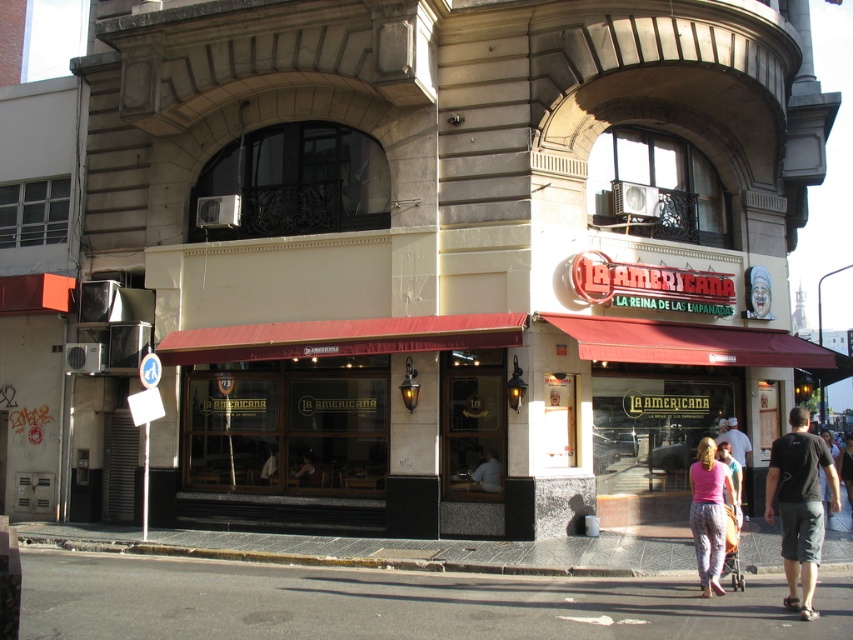
Does black cotton shirt at lower right have a lesser width compared to dark blue t-shirt at lower right?

Correct, black cotton shirt at lower right's width is less than dark blue t-shirt at lower right's.

Between black cotton shirt at lower right and dark blue t-shirt at lower right, which one is positioned lower?

dark blue t-shirt at lower right is below.

The image size is (853, 640). What do you see at coordinates (799, 506) in the screenshot? I see `black cotton shirt at lower right` at bounding box center [799, 506].

Where is `black cotton shirt at lower right`? black cotton shirt at lower right is located at coordinates (799, 506).

Does matte red awning at center have a larger size compared to black asphalt at lower center?

Actually, matte red awning at center might be smaller than black asphalt at lower center.

Is matte red awning at center positioned in front of black asphalt at lower center?

No, matte red awning at center is further to the viewer.

Between point (503, 513) and point (457, 577), which one is positioned behind?

The point (503, 513) is more distant.

Where is `matte red awning at center`? matte red awning at center is located at coordinates (357, 410).

Is matte red awning at center positioned at the back of smooth skin person at center?

No, it is in front of smooth skin person at center.

Does matte red awning at center appear over smooth skin person at center?

Yes.

Describe the element at coordinates (357, 410) in the screenshot. I see `matte red awning at center` at that location.

Image resolution: width=853 pixels, height=640 pixels. What are the coordinates of `matte red awning at center` in the screenshot? It's located at (357, 410).